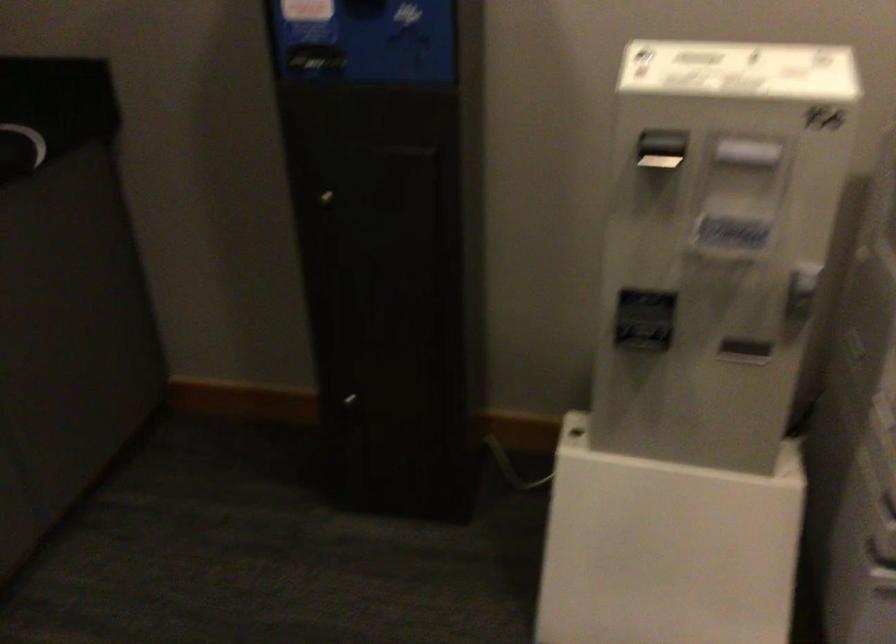
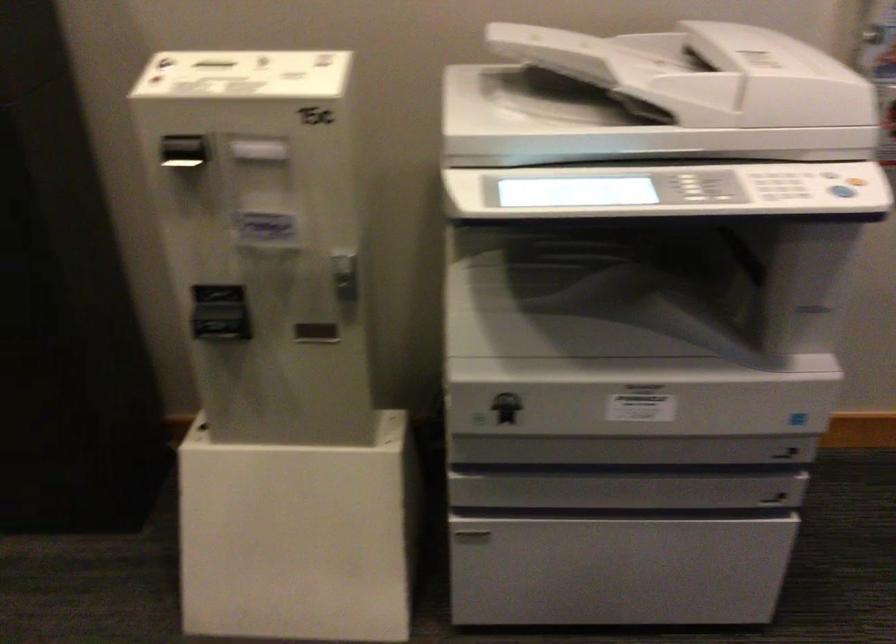
Find the pixel in the second image that matches pixel 666 152 in the first image.

(185, 156)